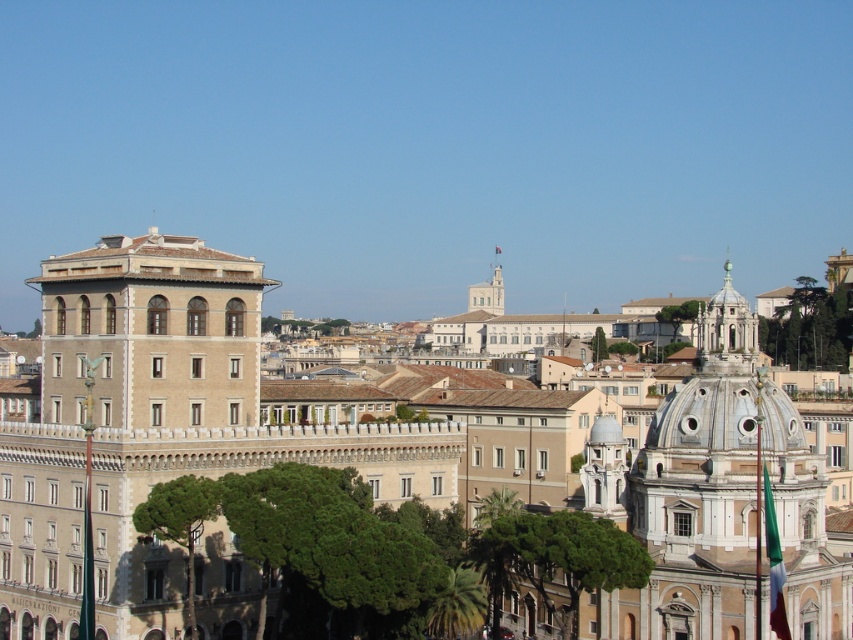
Question: Among these objects, which one is farthest from the camera?

Choices:
 (A) beige stone building at center
 (B) white marble dome at upper right

Answer: (B)

Question: Can you confirm if beige stone building at center is thinner than white marble dome at upper right?

Choices:
 (A) no
 (B) yes

Answer: (B)

Question: Does beige stone building at center have a smaller size compared to white marble dome at upper right?

Choices:
 (A) yes
 (B) no

Answer: (A)

Question: Which point is closer to the camera taking this photo?

Choices:
 (A) (738, 337)
 (B) (238, 589)

Answer: (B)

Question: Among these objects, which one is nearest to the camera?

Choices:
 (A) beige stone building at center
 (B) white marble dome at upper right

Answer: (A)

Question: Is beige stone building at center wider than white marble dome at upper right?

Choices:
 (A) no
 (B) yes

Answer: (A)